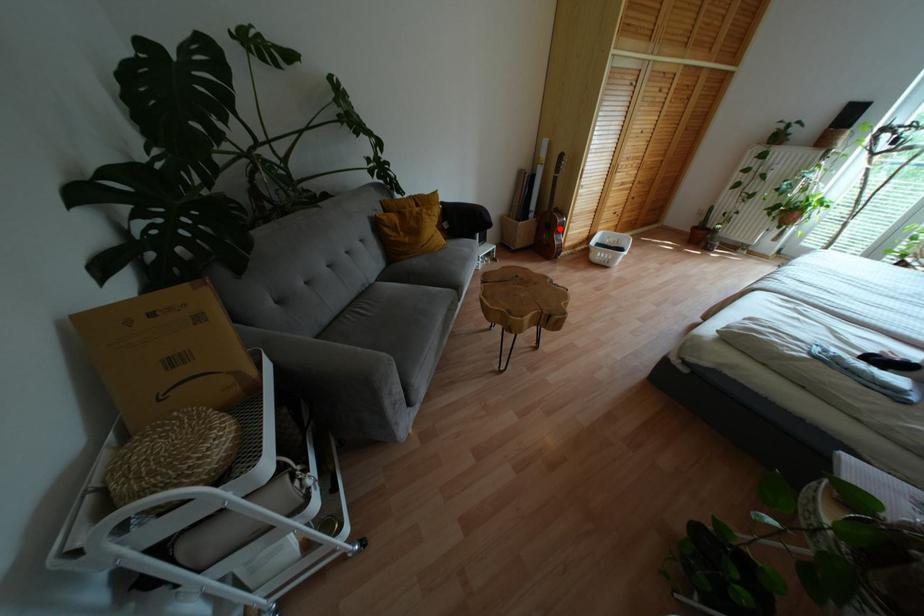
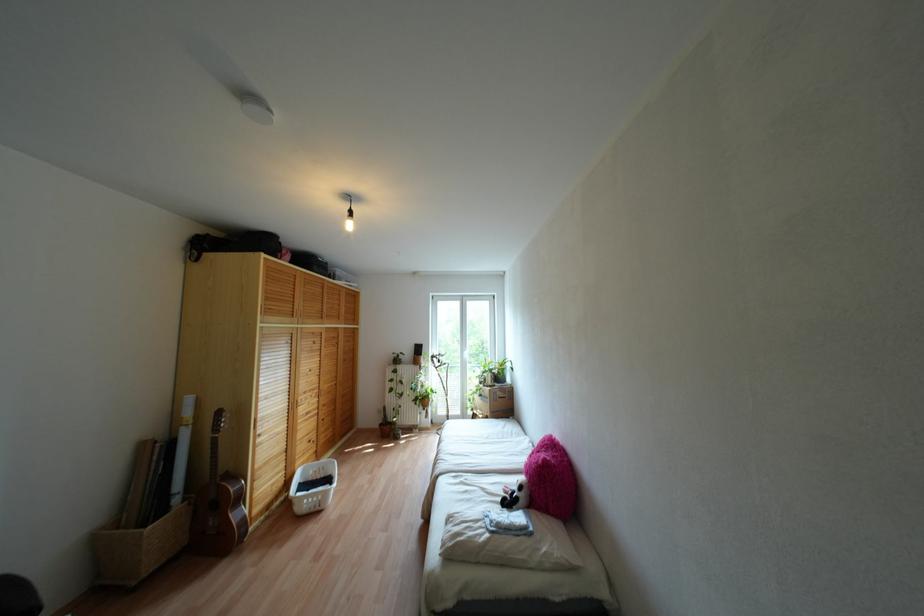
Question: A red point is marked in image1. In image2, is the corresponding 3D point closer to the camera or farther? Reply with the corresponding letter.

Choices:
 (A) The corresponding 3D point is closer.
 (B) The corresponding 3D point is farther.

Answer: (B)